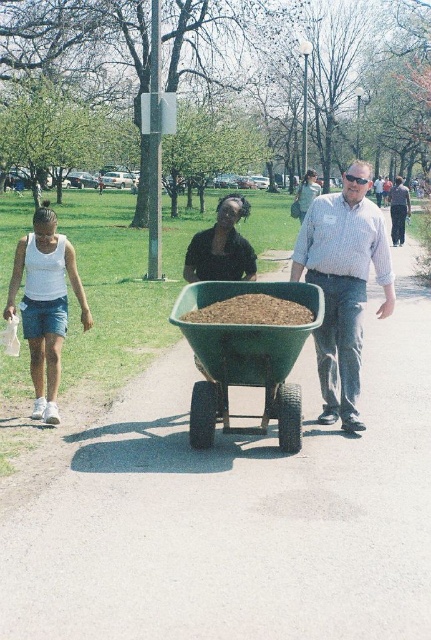
Which of these two, white matte tank top at left or dark blue jeans at center, stands taller?

With more height is dark blue jeans at center.

Does white matte tank top at left come behind dark blue jeans at center?

No, it is not.

This screenshot has height=640, width=431. What are the coordinates of `white matte tank top at left` in the screenshot? It's located at (44, 305).

Does dark blue jeans at center appear over green fabric dress at center?

Yes.

Does dark blue jeans at center appear on the left side of green fabric dress at center?

In fact, dark blue jeans at center is to the right of green fabric dress at center.

Locate an element on the screen. This screenshot has width=431, height=640. dark blue jeans at center is located at coordinates (399, 209).

This screenshot has width=431, height=640. Describe the element at coordinates (343, 285) in the screenshot. I see `matte blue shirt at center` at that location.

Is matte blue shirt at center to the left of matte black shirt at center from the viewer's perspective?

No, matte blue shirt at center is not to the left of matte black shirt at center.

Who is more forward, (349, 387) or (216, 237)?

Positioned in front is point (349, 387).

Find the location of a particular element. This screenshot has width=431, height=640. matte blue shirt at center is located at coordinates point(343,285).